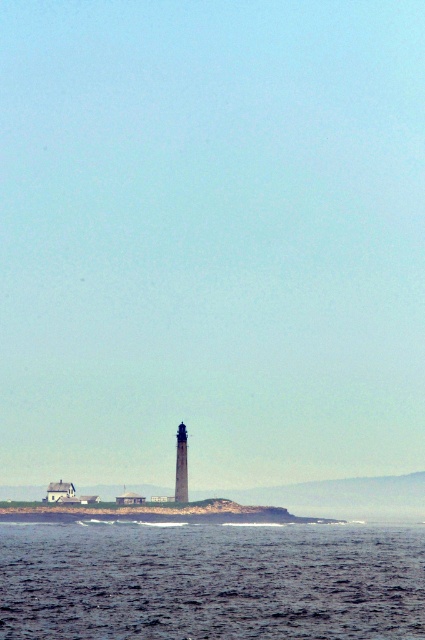
Question: Among these points, which one is farthest from the camera?

Choices:
 (A) (184, 460)
 (B) (399, 620)

Answer: (A)

Question: Does dark blue water at lower center have a smaller size compared to smooth gray tower at center?

Choices:
 (A) yes
 (B) no

Answer: (B)

Question: Is dark blue water at lower center positioned at the back of smooth gray tower at center?

Choices:
 (A) no
 (B) yes

Answer: (A)

Question: In this image, where is dark blue water at lower center located relative to smooth gray tower at center?

Choices:
 (A) above
 (B) below

Answer: (B)

Question: Which object is farther from the camera taking this photo?

Choices:
 (A) dark blue water at lower center
 (B) smooth gray tower at center

Answer: (B)